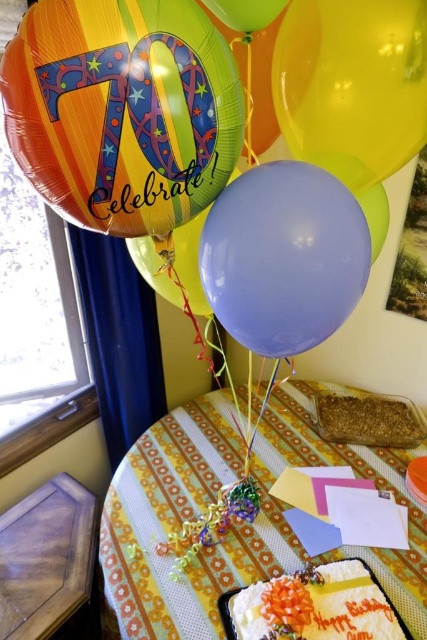
Question: Based on their relative distances, which object is nearer to the yellow fabric tablecloth at lower center?

Choices:
 (A) white frosted cake with orange flower at center
 (B) matte purple balloon at center
 (C) translucent yellow balloon at upper right
 (D) multicolored metallic balloon at upper left

Answer: (A)

Question: Does multicolored metallic balloon at upper left come in front of white frosted cake with orange flower at center?

Choices:
 (A) no
 (B) yes

Answer: (B)

Question: Can you confirm if matte purple balloon at center is thinner than translucent yellow balloon at upper right?

Choices:
 (A) yes
 (B) no

Answer: (B)

Question: Which of the following is the farthest from the observer?

Choices:
 (A) yellow fabric tablecloth at lower center
 (B) translucent yellow balloon at upper right

Answer: (A)

Question: Which point is farther to the camera?

Choices:
 (A) translucent yellow balloon at upper right
 (B) white frosted cake with orange flower at center

Answer: (B)

Question: Does multicolored metallic balloon at upper left appear on the left side of yellow fabric tablecloth at lower center?

Choices:
 (A) yes
 (B) no

Answer: (A)